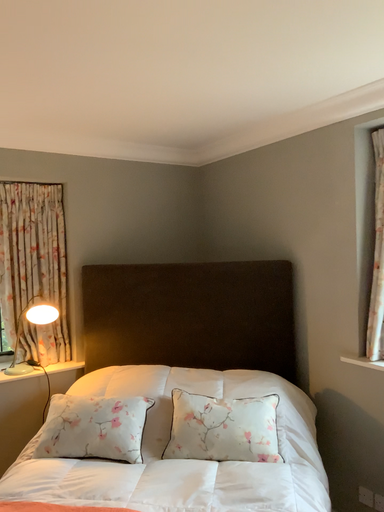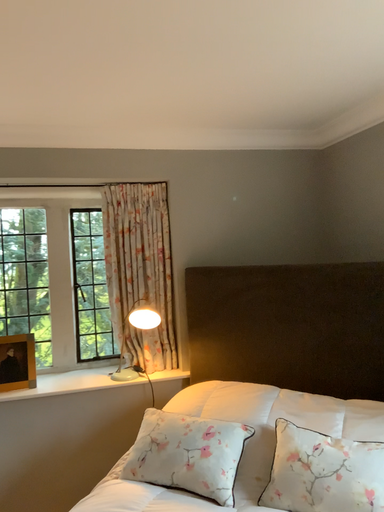
Question: Which way did the camera rotate in the video?

Choices:
 (A) rotated right
 (B) rotated left

Answer: (B)